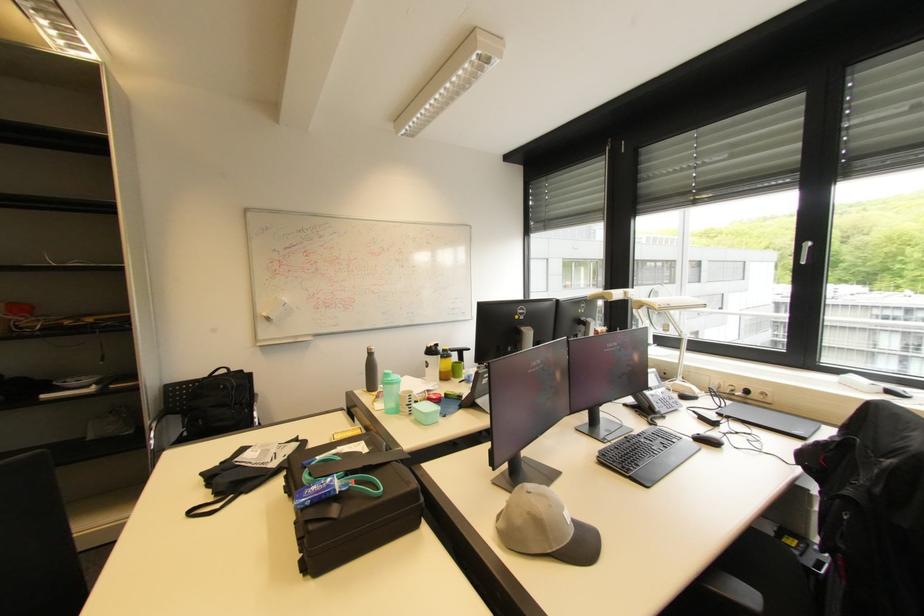
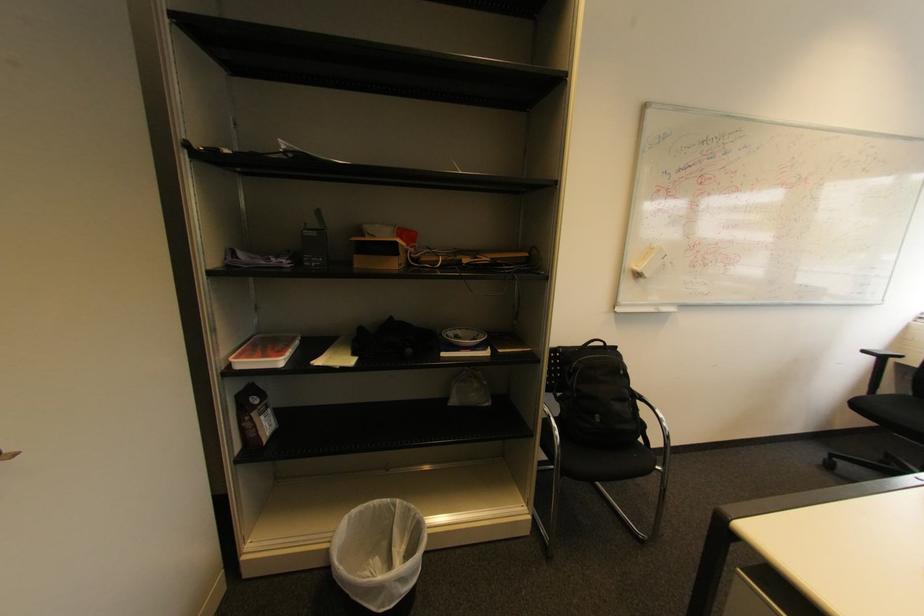
Where in the second image is the point corresponding to (x=237, y=371) from the first image?

(613, 345)